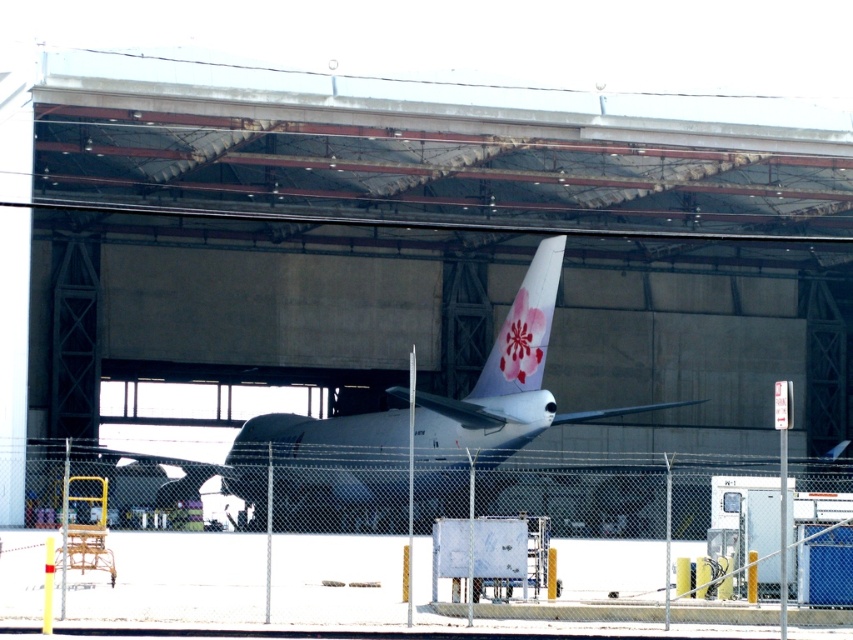
Question: Which point is closer to the camera taking this photo?

Choices:
 (A) (486, 369)
 (B) (347, 480)

Answer: (B)

Question: Which object appears closest to the camera in this image?

Choices:
 (A) white matte airplane at center
 (B) chain-link fence at center

Answer: (B)

Question: Which object is closer to the camera taking this photo?

Choices:
 (A) white matte airplane at center
 (B) chain-link fence at center

Answer: (B)

Question: Can you confirm if chain-link fence at center is positioned above white matte airplane at center?

Choices:
 (A) no
 (B) yes

Answer: (A)

Question: Is chain-link fence at center smaller than white matte airplane at center?

Choices:
 (A) no
 (B) yes

Answer: (B)

Question: Can you confirm if chain-link fence at center is positioned below white matte airplane at center?

Choices:
 (A) no
 (B) yes

Answer: (B)